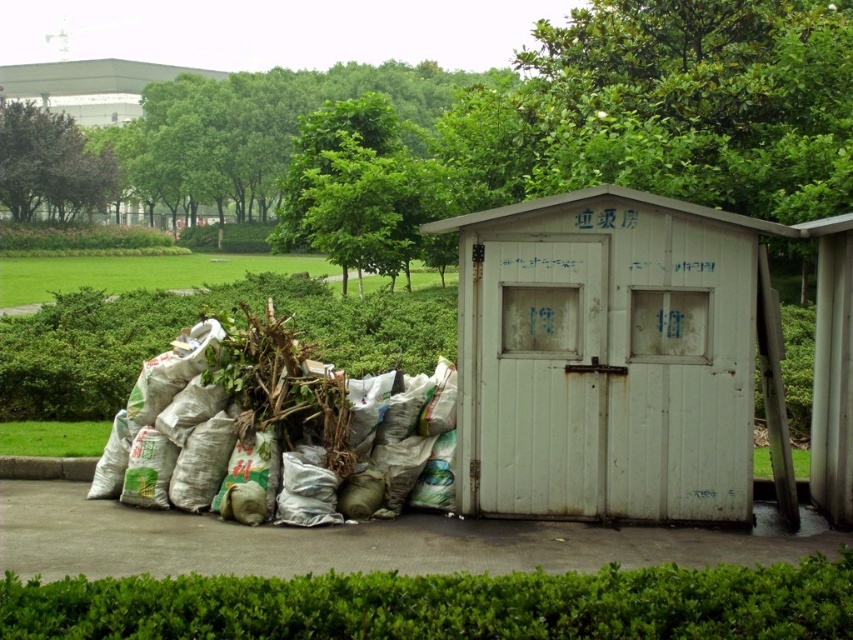
Can you confirm if white matte shed at center is wider than white painted wood hut at center?

No, white matte shed at center is not wider than white painted wood hut at center.

Which of these two, white matte shed at center or white painted wood hut at center, stands taller?

With more height is white painted wood hut at center.

Describe the element at coordinates (601, 352) in the screenshot. The height and width of the screenshot is (640, 853). I see `white matte shed at center` at that location.

You are a GUI agent. You are given a task and a screenshot of the screen. Output one action in this format:
    pyautogui.click(x=<x>, y=<y>)
    Task: Click on the white matte shed at center
    Image resolution: width=853 pixels, height=640 pixels.
    Given the screenshot: What is the action you would take?
    pyautogui.click(x=601, y=352)

Is white painted wood hut at center to the left of white cardboard hut at upper left from the viewer's perspective?

In fact, white painted wood hut at center is to the right of white cardboard hut at upper left.

The width and height of the screenshot is (853, 640). Describe the element at coordinates (614, 358) in the screenshot. I see `white painted wood hut at center` at that location.

Image resolution: width=853 pixels, height=640 pixels. I want to click on white painted wood hut at center, so click(x=614, y=358).

Which is below, white fabric bags at center or white cardboard hut at upper left?

Positioned lower is white fabric bags at center.

Describe the element at coordinates (241, 416) in the screenshot. The width and height of the screenshot is (853, 640). I see `white fabric bags at center` at that location.

In order to click on white fabric bags at center in this screenshot , I will do `click(241, 416)`.